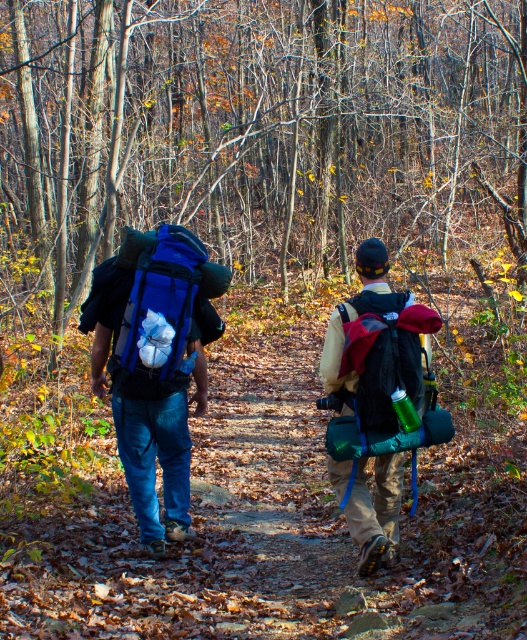
Question: Does matte blue backpack at center have a smaller size compared to matte black backpack at center?

Choices:
 (A) no
 (B) yes

Answer: (A)

Question: Considering the relative positions of matte blue backpack at center and blue fabric backpack at left in the image provided, where is matte blue backpack at center located with respect to blue fabric backpack at left?

Choices:
 (A) right
 (B) left

Answer: (A)

Question: Which point is closer to the camera taking this photo?

Choices:
 (A) (375, 467)
 (B) (415, 388)

Answer: (B)

Question: Which point is farther to the camera?

Choices:
 (A) (177, 289)
 (B) (355, 339)
 (C) (357, 307)

Answer: (A)

Question: Estimate the real-world distances between objects in this image. Which object is farther from the blue fabric backpack at left?

Choices:
 (A) matte blue backpack at center
 (B) matte black backpack at center

Answer: (B)

Question: Is blue fabric backpack at left further to the viewer compared to matte black backpack at center?

Choices:
 (A) yes
 (B) no

Answer: (A)